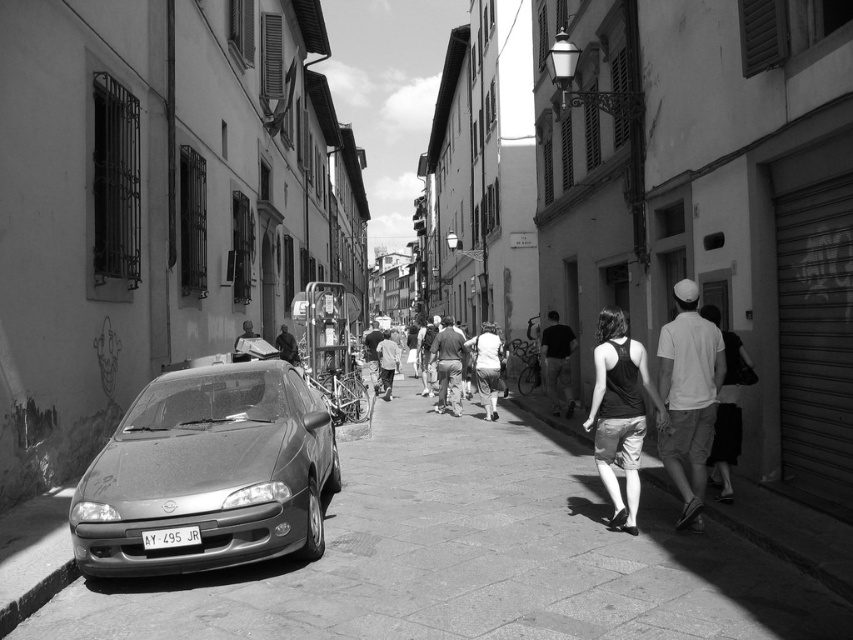
Which is above, matte gray car at left or white cotton backpack at center?

white cotton backpack at center is above.

Is matte gray car at left smaller than white cotton backpack at center?

Actually, matte gray car at left might be larger than white cotton backpack at center.

Find the location of a particular element. Image resolution: width=853 pixels, height=640 pixels. matte gray car at left is located at coordinates (207, 474).

The width and height of the screenshot is (853, 640). Identify the location of matte gray car at left. (207, 474).

Between point (683, 499) and point (286, 348), which one is positioned behind?

Point (286, 348)

Does point (715, 376) come behind point (283, 348)?

No, (715, 376) is closer to viewer.

Does point (695, 508) lie in front of point (285, 333)?

Yes, it is in front of point (285, 333).

Find the location of a particular element. white cotton shirt at right is located at coordinates (688, 397).

Which is more to the right, smooth concrete pavement at lower left or light gray cotton shirt at center?

smooth concrete pavement at lower left is more to the right.

Measure the distance between smooth concrete pavement at lower left and light gray cotton shirt at center.

smooth concrete pavement at lower left and light gray cotton shirt at center are 11.80 meters apart.

Locate an element on the screen. smooth concrete pavement at lower left is located at coordinates (469, 557).